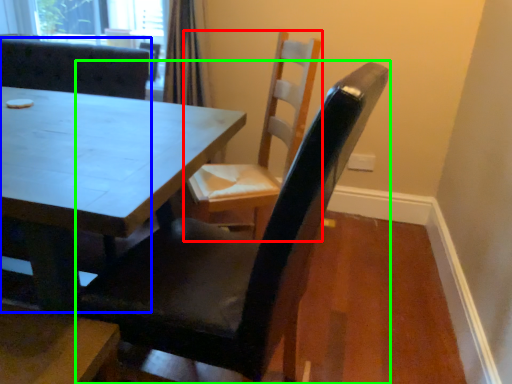
Question: Considering the real-world distances, which object is farthest from chair (highlighted by a red box)? chair (highlighted by a blue box) or chair (highlighted by a green box)?

Choices:
 (A) chair
 (B) chair

Answer: (A)